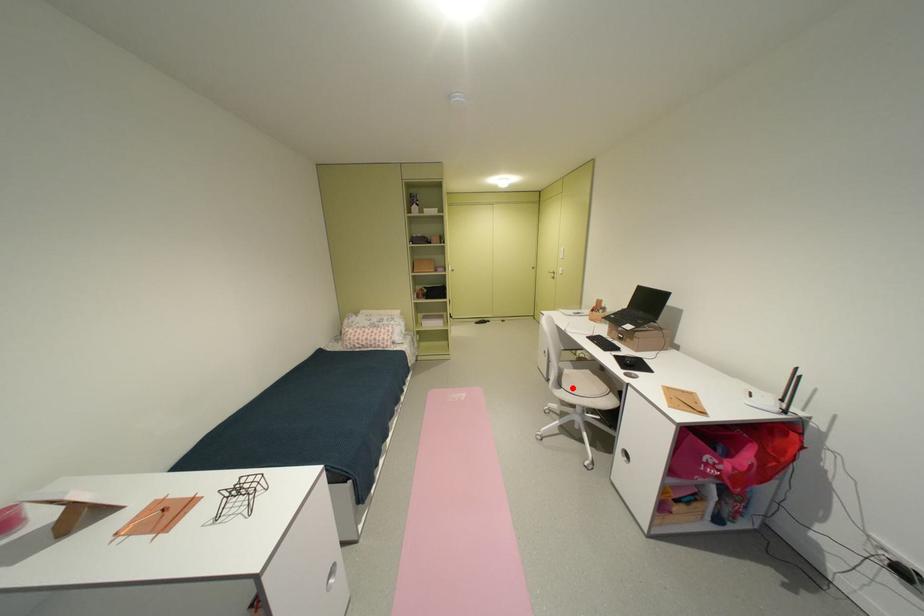
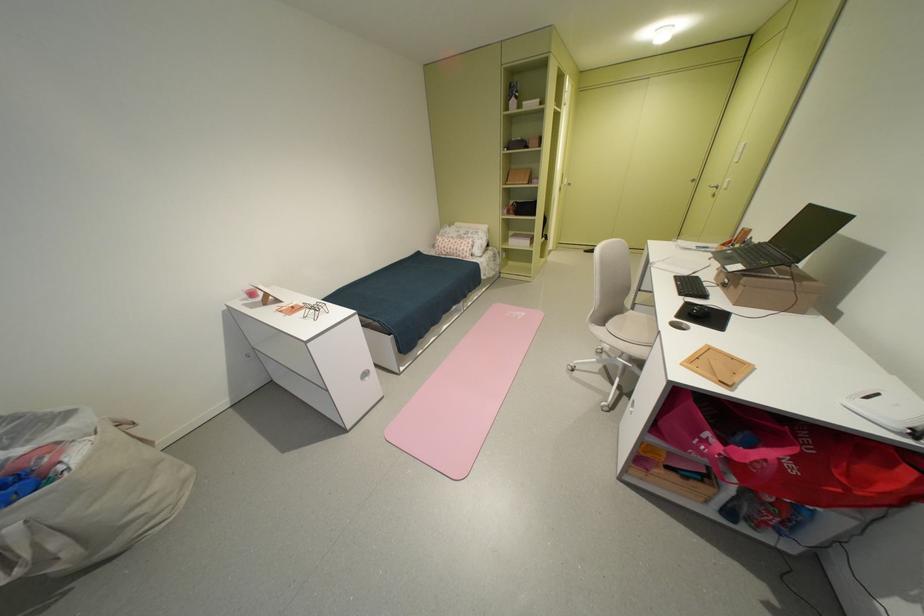
Question: I am providing you with two images of the same scene from different viewpoints. Given a red point in image1, look at the same physical point in image2. Is it:

Choices:
 (A) Closer to the viewpoint
 (B) Farther from the viewpoint

Answer: (B)